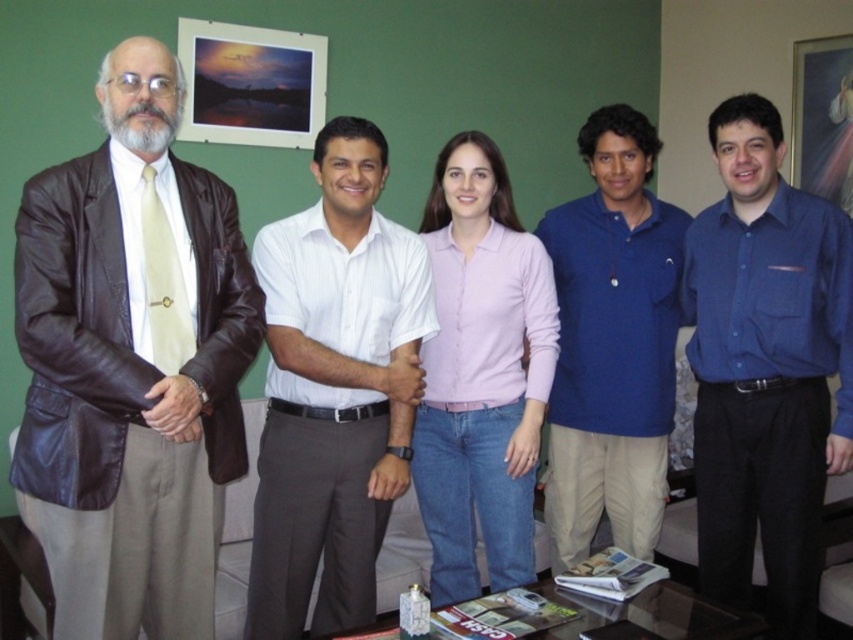
Question: Estimate the real-world distances between objects in this image. Which object is farther from the blue button-down shirt at center?

Choices:
 (A) blue cotton polo shirt at center
 (B) brown leather jacket at left
 (C) white cotton shirt at center
 (D) wooden picture frame at upper right

Answer: (B)

Question: Can you confirm if white cotton shirt at center is positioned above wooden picture frame at upper right?

Choices:
 (A) no
 (B) yes

Answer: (A)

Question: Which object is farther from the camera taking this photo?

Choices:
 (A) pink cotton shirt at center
 (B) blue cotton polo shirt at center
 (C) white cotton shirt at center
 (D) wooden picture frame at upper right

Answer: (D)

Question: Does brown leather jacket at left have a larger size compared to white cotton shirt at center?

Choices:
 (A) yes
 (B) no

Answer: (A)

Question: Where is white cotton shirt at center located in relation to wooden picture frame at upper right in the image?

Choices:
 (A) below
 (B) above

Answer: (A)

Question: Which point is farther to the camera?

Choices:
 (A) blue button-down shirt at center
 (B) pink cotton shirt at center
 (C) brown leather jacket at left
 (D) white cotton shirt at center

Answer: (B)